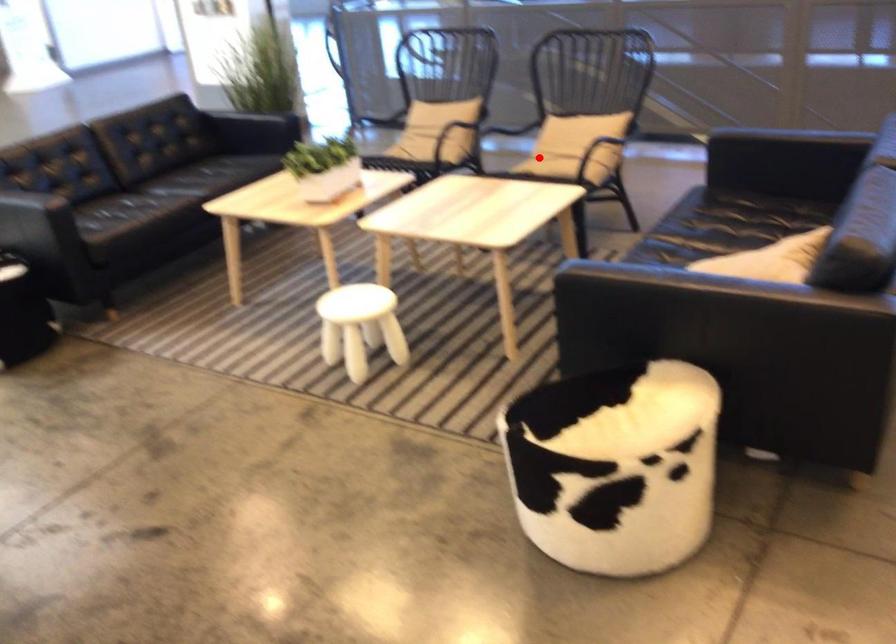
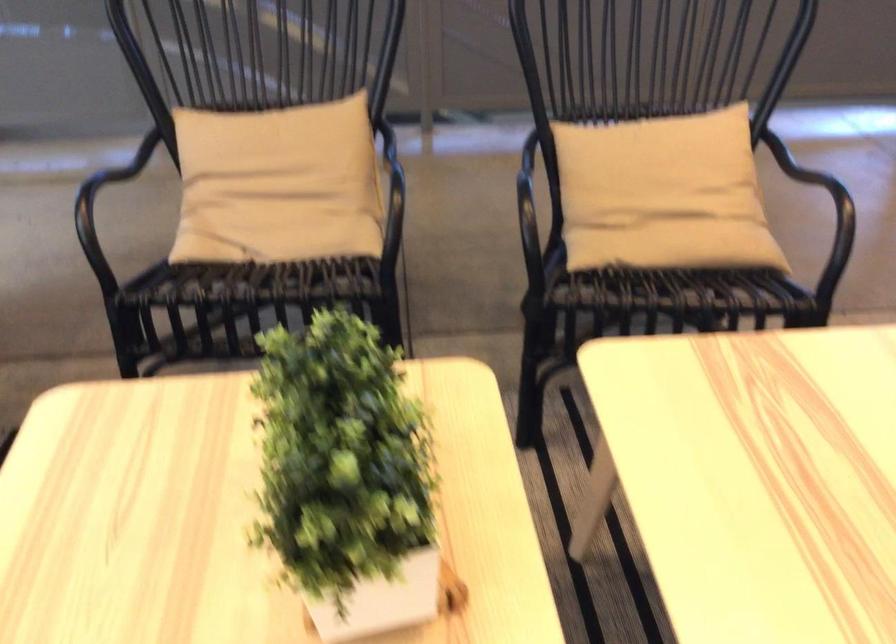
Where in the second image is the point corresponding to the highlighted location from the first image?

(674, 245)